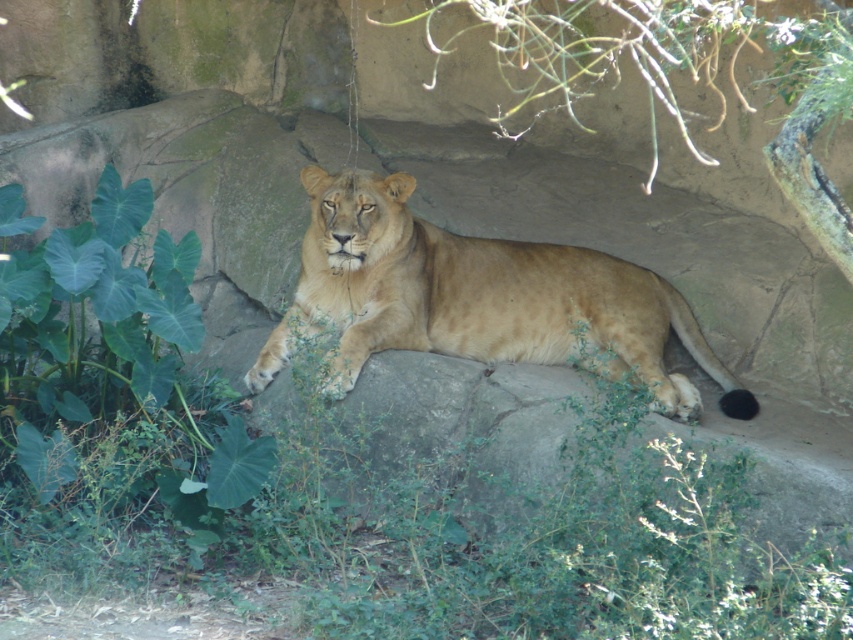
Find the location of a particular element. green leafy plant at lower left is located at coordinates (370, 493).

Does green leafy plant at lower left have a smaller size compared to golden fur lion at center?

Actually, green leafy plant at lower left might be larger than golden fur lion at center.

Does point (306, 580) lie in front of point (651, 332)?

That is True.

Locate an element on the screen. The height and width of the screenshot is (640, 853). green leafy plant at lower left is located at coordinates (370, 493).